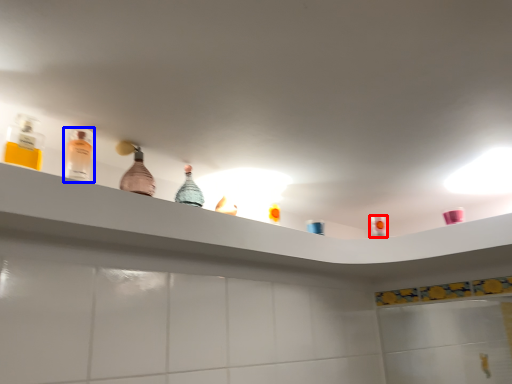
Question: Which of the following is the farthest to the observer, mouthwash (highlighted by a red box) or bottle (highlighted by a blue box)?

Choices:
 (A) mouthwash
 (B) bottle

Answer: (A)